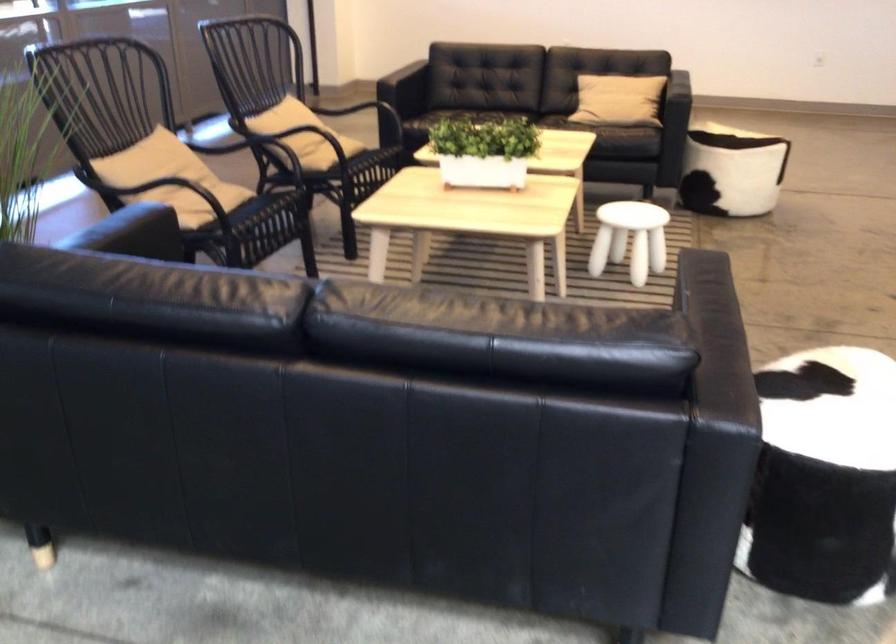
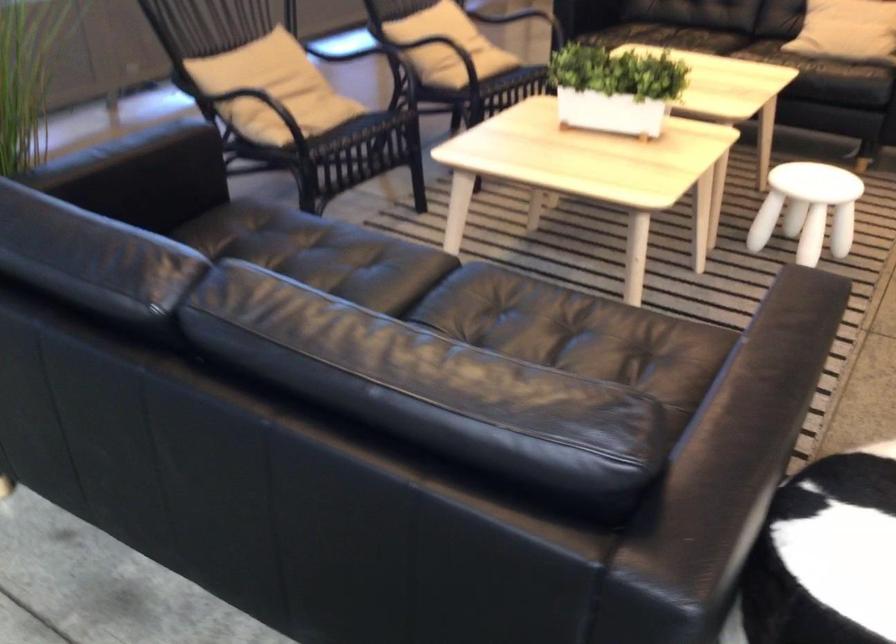
Where in the second image is the point corresponding to point 636,232 from the first image?

(807, 209)